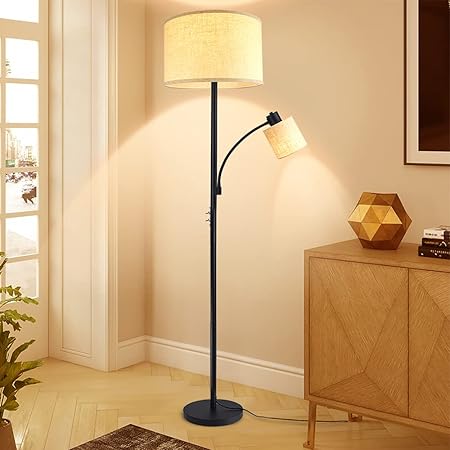
Identify the location of lamp. The image size is (450, 450). (199, 31), (278, 145).